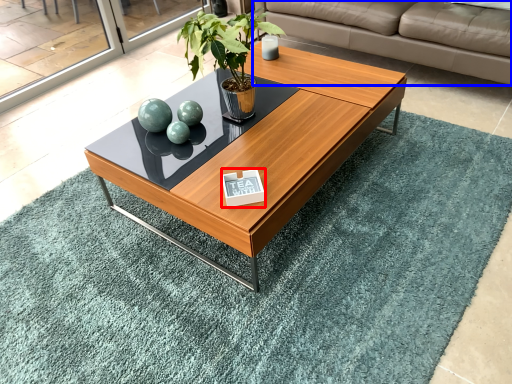
Question: Among these objects, which one is farthest to the camera, plaque (highlighted by a red box) or studio couch (highlighted by a blue box)?

Choices:
 (A) plaque
 (B) studio couch

Answer: (B)